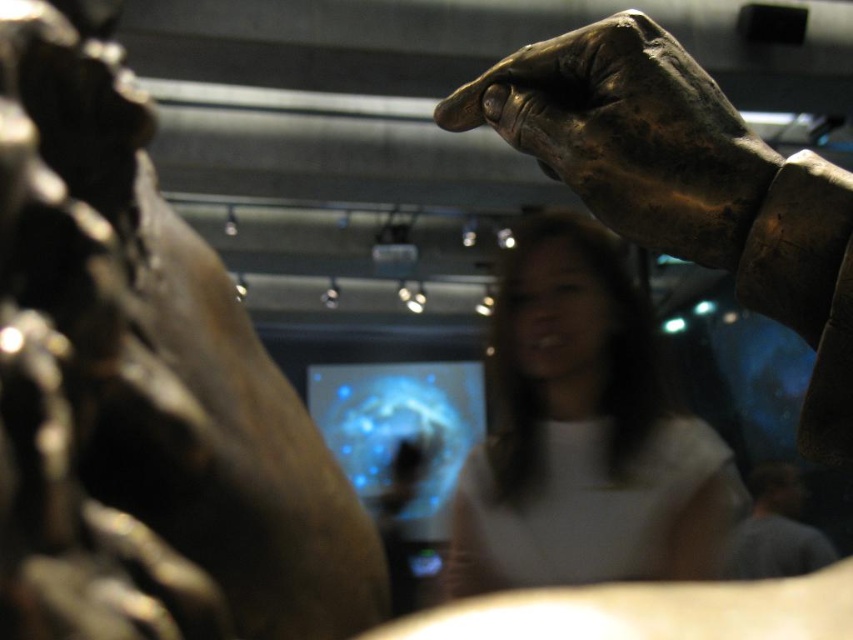
You are a security guard in the museum and need to ensure visitors maintain a minimum distance of 8 inches between them and the exhibits. A visitor is standing between the shiny bronze statue at upper left and the bronze textured hand at upper right. Is the distance between these two objects sufficient to allow the visitor to stand there without violating the safety rule?

The distance between the shiny bronze statue at upper left and the bronze textured hand at upper right is 8.60 inches. Since the required minimum distance is 8 inches, the visitor can stand there as the space between them is sufficient.

You are a security guard in the gallery. You need to locate the white matte shirt at center in the image. Where is it positioned in terms of coordinates?

The white matte shirt at center is located at coordinates point (583, 435).

You are a visitor in the museum and want to take a photo of the shiny bronze statue at upper left. If you are standing at the center of the room, which direction should you move to get a better view of the statue?

Since the shiny bronze statue at upper left is located at point (143, 388), you should move towards the upper left direction from the center to get a better view of the statue.